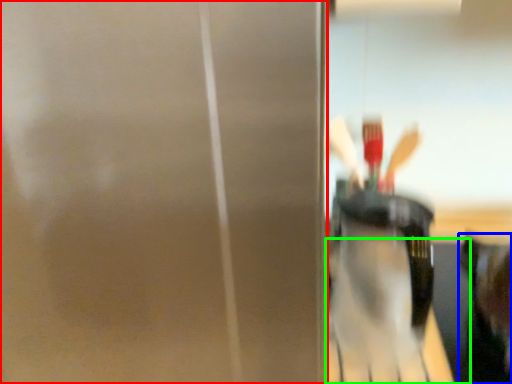
Question: Which object is positioned farthest from screen door (highlighted by a red box)? Select from person (highlighted by a blue box) and table (highlighted by a green box).

Choices:
 (A) person
 (B) table

Answer: (B)